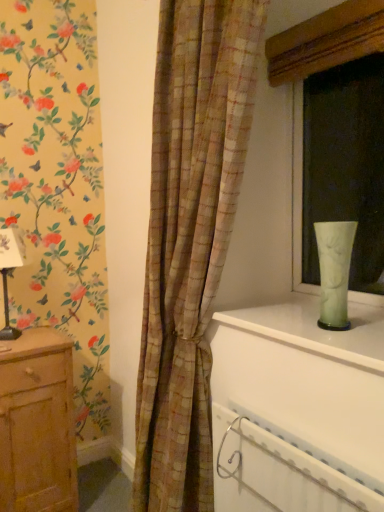
Question: Is green glass vase at upper right taller or shorter than white plastic radiator at lower right?

Choices:
 (A) short
 (B) tall

Answer: (A)

Question: Which is correct: green glass vase at upper right is inside white plastic radiator at lower right, or outside of it?

Choices:
 (A) inside
 (B) outside

Answer: (B)

Question: Estimate the real-world distances between objects in this image. Which object is closer to the white plastic radiator at lower right?

Choices:
 (A) green marble vase at upper right
 (B) matte black table lamp at left
 (C) wooden chest of drawers at left
 (D) plaid fabric curtain at center
 (E) matte glass vase at right

Answer: (A)

Question: Estimate the real-world distances between objects in this image. Which object is closer to the wooden chest of drawers at left?

Choices:
 (A) green glass vase at upper right
 (B) white plastic radiator at lower right
 (C) plaid fabric curtain at center
 (D) matte glass vase at right
 (E) matte black table lamp at left

Answer: (E)